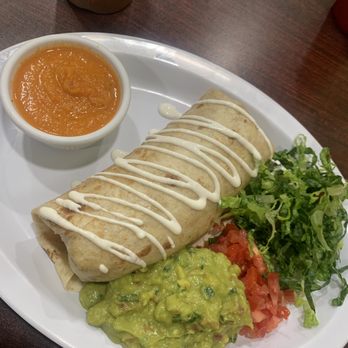
Where is `sauce container`? The width and height of the screenshot is (348, 348). sauce container is located at coordinates (125, 81).